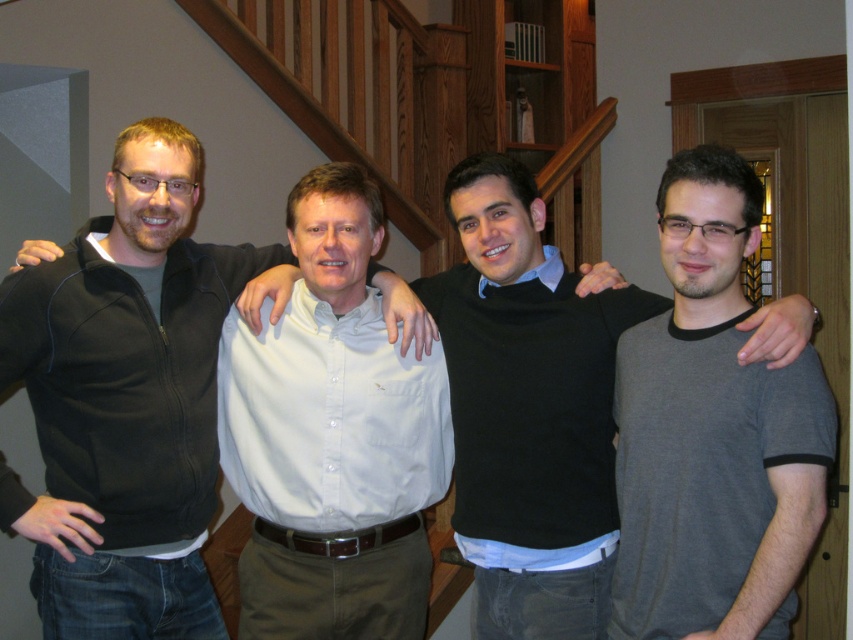
Question: Which point is closer to the camera?

Choices:
 (A) pyautogui.click(x=283, y=358)
 (B) pyautogui.click(x=496, y=468)
 (C) pyautogui.click(x=111, y=496)
 (D) pyautogui.click(x=766, y=588)

Answer: (D)

Question: Can you confirm if black zip-up jacket at left is positioned below white shirt at center?

Choices:
 (A) yes
 (B) no

Answer: (B)

Question: From the image, what is the correct spatial relationship of white shirt at center in relation to gray cotton t-shirt at right?

Choices:
 (A) left
 (B) right

Answer: (A)

Question: Which is farther from the gray cotton t-shirt at right?

Choices:
 (A) black sweater at center
 (B) white shirt at center

Answer: (B)

Question: Where is black zip-up jacket at left located in relation to gray cotton t-shirt at right in the image?

Choices:
 (A) above
 (B) below

Answer: (B)

Question: Which object is closer to the camera taking this photo?

Choices:
 (A) gray cotton t-shirt at right
 (B) white shirt at center
 (C) black zip-up jacket at left

Answer: (A)